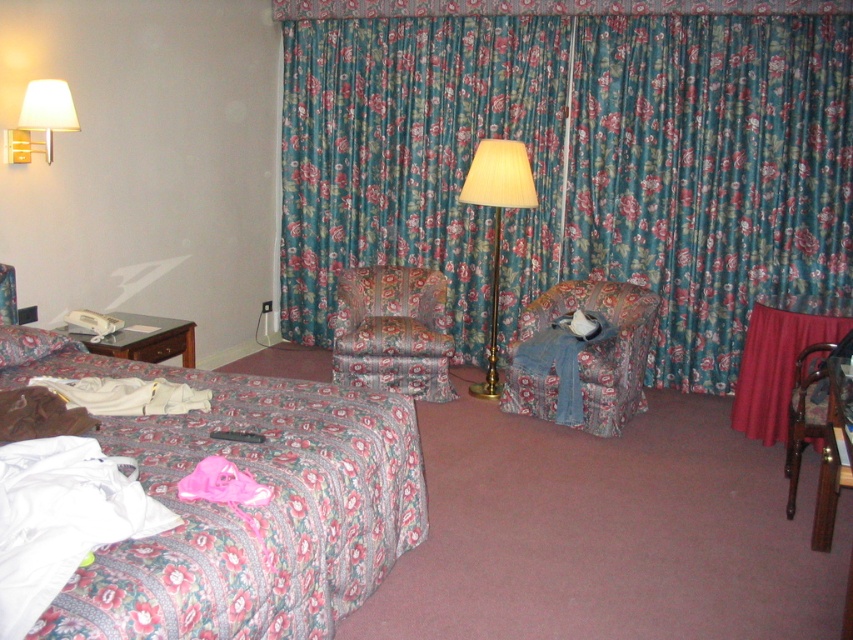
Consider the image. How far apart are floral fabric armchair at center and ivory fabric lamp at center?

The distance of floral fabric armchair at center from ivory fabric lamp at center is 23.09 inches.

This screenshot has width=853, height=640. What are the coordinates of `floral fabric armchair at center` in the screenshot? It's located at (393, 332).

This screenshot has height=640, width=853. Find the location of `floral fabric armchair at center`. floral fabric armchair at center is located at coordinates (393, 332).

At what (x,y) coordinates should I click in order to perform the action: click on floral fabric chair at center. Please return your answer as a coordinate pair (x, y). Looking at the image, I should click on (602, 346).

What do you see at coordinates (602, 346) in the screenshot? This screenshot has width=853, height=640. I see `floral fabric chair at center` at bounding box center [602, 346].

The width and height of the screenshot is (853, 640). Find the location of `floral fabric chair at center`. floral fabric chair at center is located at coordinates (602, 346).

Between ivory fabric lamp at center and white soft pillow at lower left, which one appears on the left side from the viewer's perspective?

white soft pillow at lower left is more to the left.

Is ivory fabric lamp at center bigger than white soft pillow at lower left?

Indeed, ivory fabric lamp at center has a larger size compared to white soft pillow at lower left.

Where is `ivory fabric lamp at center`? The image size is (853, 640). ivory fabric lamp at center is located at coordinates pyautogui.click(x=497, y=220).